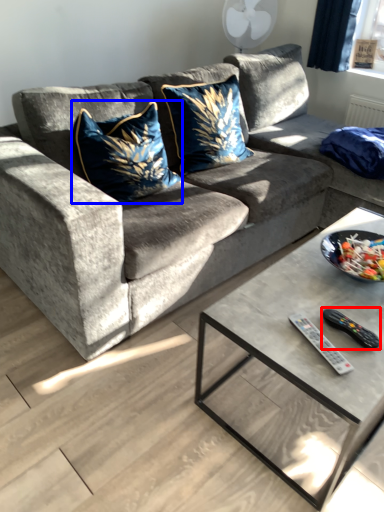
Question: Which point is further to the camera, remote (highlighted by a red box) or throw pillow (highlighted by a blue box)?

Choices:
 (A) remote
 (B) throw pillow

Answer: (B)